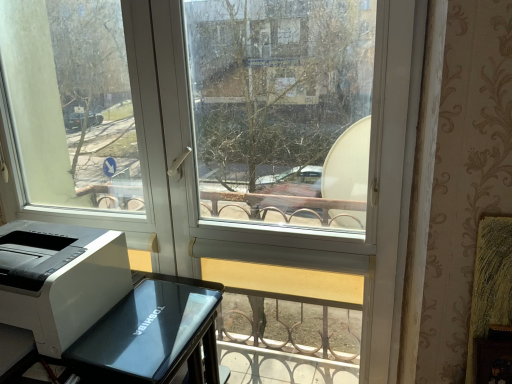
Question: Can you confirm if white glossy printer at lower left is smaller than white plastic printer at lower left?

Choices:
 (A) yes
 (B) no

Answer: (B)

Question: Can you confirm if white glossy printer at lower left is wider than white plastic printer at lower left?

Choices:
 (A) no
 (B) yes

Answer: (B)

Question: From a real-world perspective, is white glossy printer at lower left located higher than white plastic printer at lower left?

Choices:
 (A) yes
 (B) no

Answer: (B)

Question: From the image's perspective, would you say white glossy printer at lower left is shown under white plastic printer at lower left?

Choices:
 (A) no
 (B) yes

Answer: (B)

Question: Is white glossy printer at lower left oriented away from white plastic printer at lower left?

Choices:
 (A) no
 (B) yes

Answer: (A)

Question: Is white glossy printer at lower left beside white plastic printer at lower left?

Choices:
 (A) yes
 (B) no

Answer: (B)

Question: Can you confirm if white plastic printer at lower left is thinner than white glossy printer at lower left?

Choices:
 (A) yes
 (B) no

Answer: (A)

Question: Considering the relative positions of white plastic printer at lower left and white glossy printer at lower left in the image provided, is white plastic printer at lower left behind white glossy printer at lower left?

Choices:
 (A) yes
 (B) no

Answer: (A)

Question: From the image's perspective, is white plastic printer at lower left on top of white glossy printer at lower left?

Choices:
 (A) no
 (B) yes

Answer: (B)

Question: Is white plastic printer at lower left to the right of white glossy printer at lower left from the viewer's perspective?

Choices:
 (A) no
 (B) yes

Answer: (A)

Question: Is white plastic printer at lower left shorter than white glossy printer at lower left?

Choices:
 (A) yes
 (B) no

Answer: (A)

Question: Considering the relative sizes of white plastic printer at lower left and white glossy printer at lower left in the image provided, is white plastic printer at lower left taller than white glossy printer at lower left?

Choices:
 (A) yes
 (B) no

Answer: (B)

Question: In terms of width, does white glossy printer at lower left look wider or thinner when compared to white plastic printer at lower left?

Choices:
 (A) thin
 (B) wide

Answer: (B)